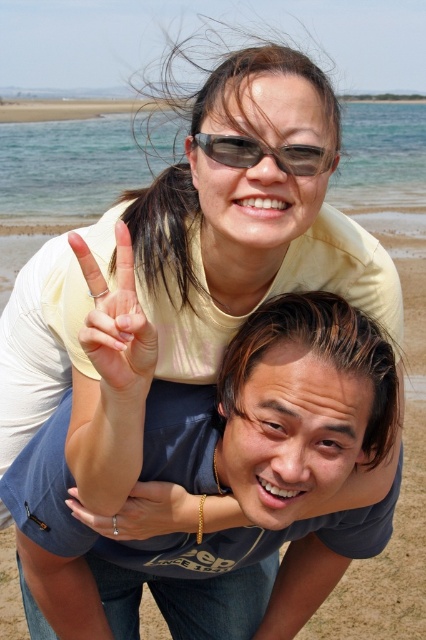
Question: Which object is closer to the camera taking this photo?

Choices:
 (A) matte yellow hand at center
 (B) blue cotton shirt at center

Answer: (A)

Question: Among these points, which one is nearest to the camera?

Choices:
 (A) pos(94,332)
 (B) pos(233,157)
 (C) pos(163,508)
 (D) pos(360,314)

Answer: (A)

Question: Does blue cotton shirt at center appear on the left side of matte black sunglasses at upper center?

Choices:
 (A) yes
 (B) no

Answer: (A)

Question: Can you confirm if silver metallic ring at center is thinner than matte black sunglasses at upper center?

Choices:
 (A) yes
 (B) no

Answer: (B)

Question: Which point is closer to the camera taking this photo?

Choices:
 (A) (126, 326)
 (B) (299, 145)
 (C) (149, 484)
 (D) (337, 570)

Answer: (A)

Question: Does blue cotton shirt at center appear on the left side of silver metallic ring at center?

Choices:
 (A) yes
 (B) no

Answer: (B)